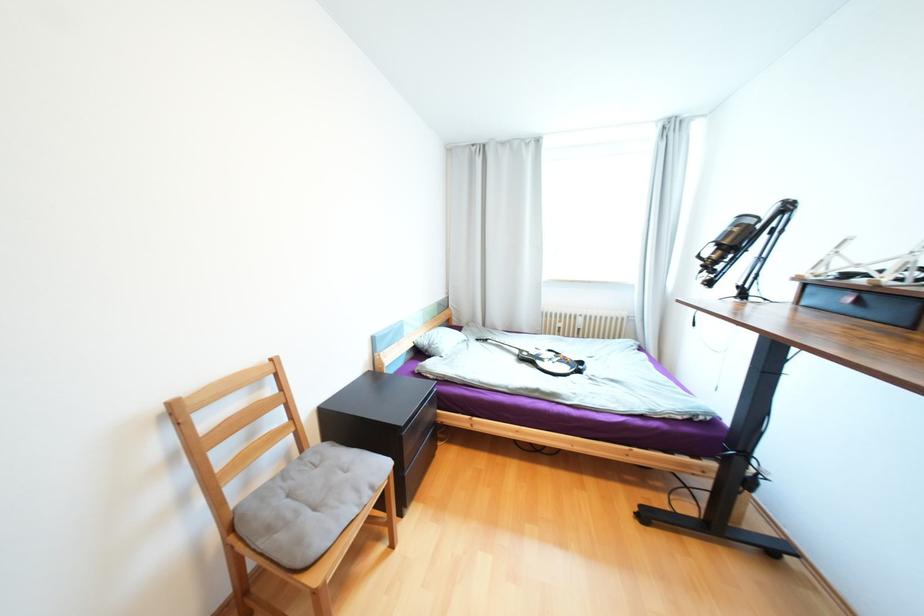
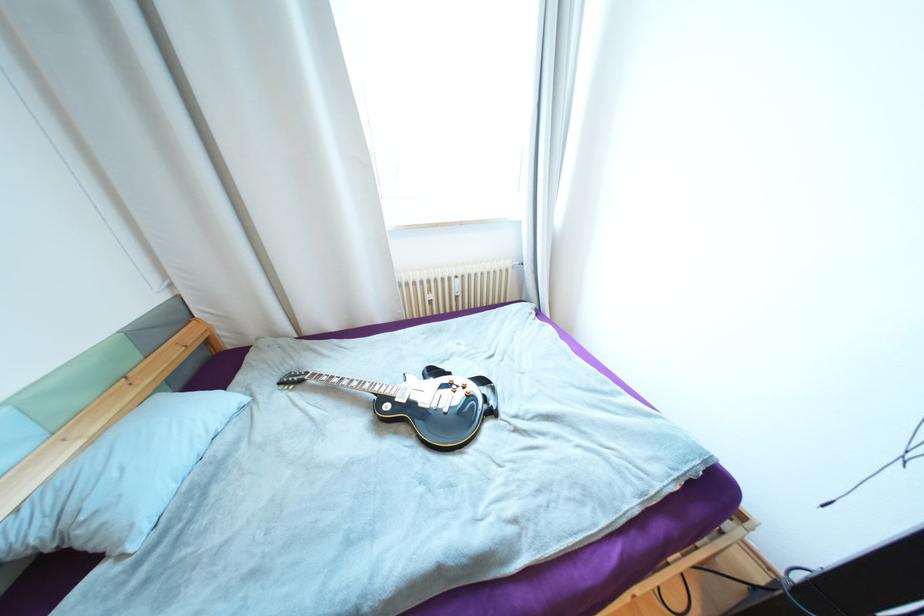
Find the pixel in the second image that matches point 442,346 in the first image.

(101, 525)